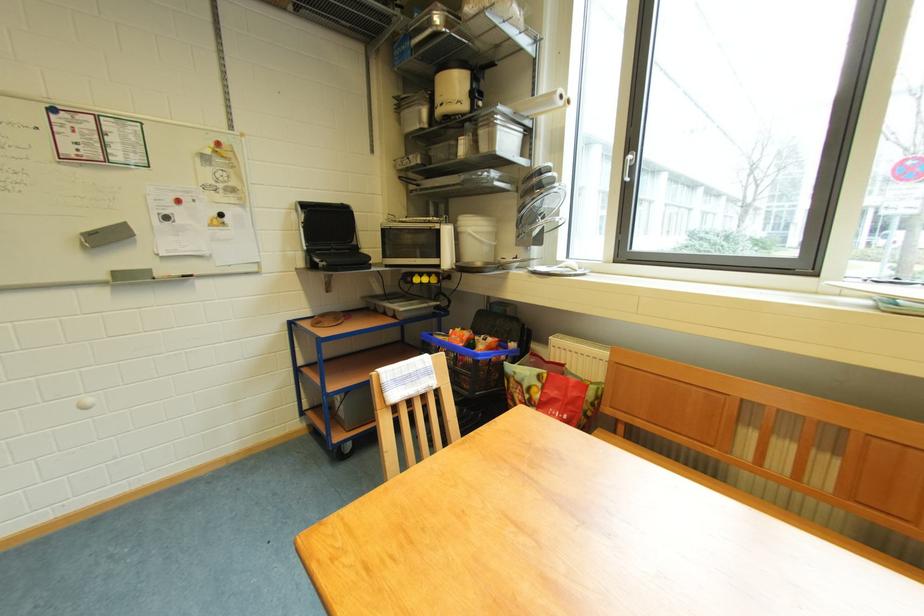
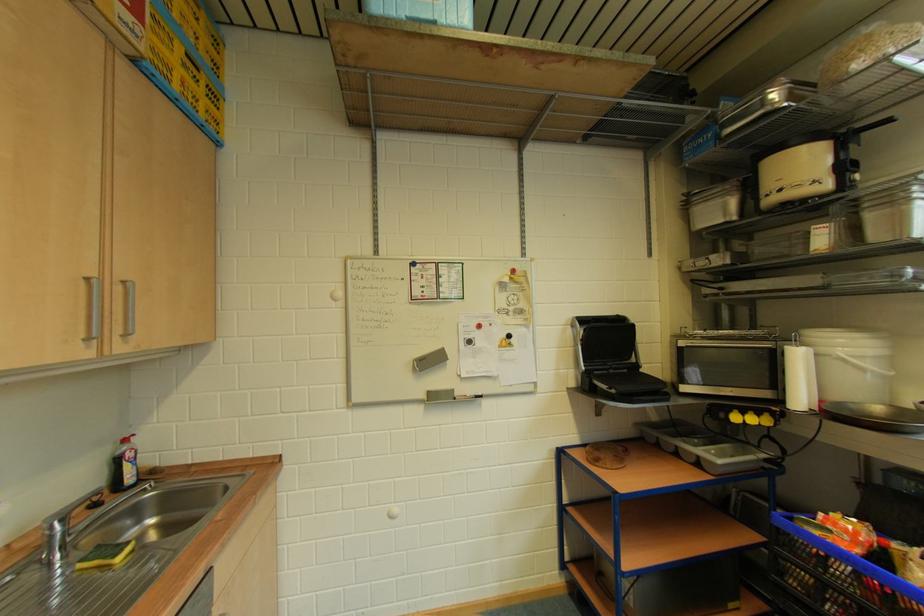
Find the pixel in the second image that matches the point at 481,235 in the first image.

(858, 360)